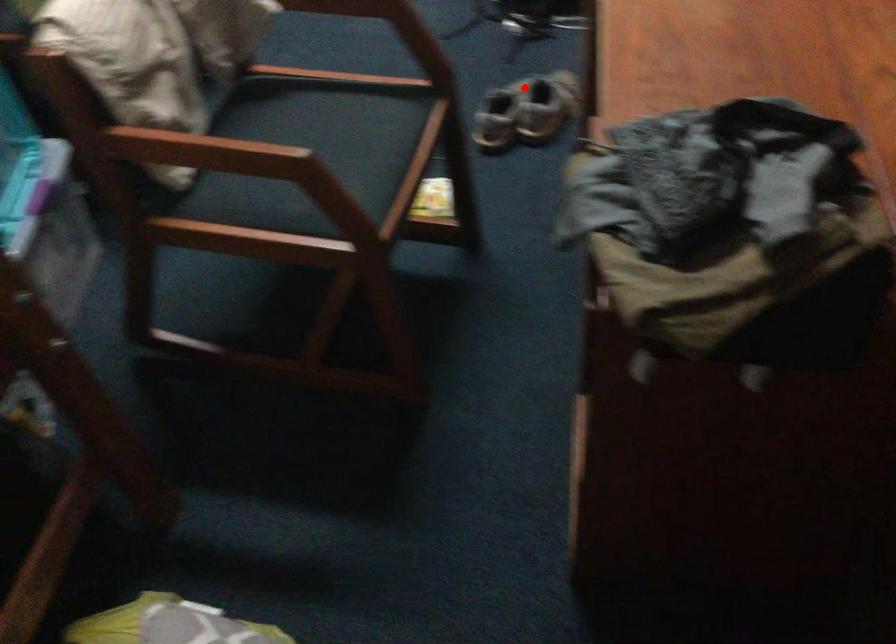
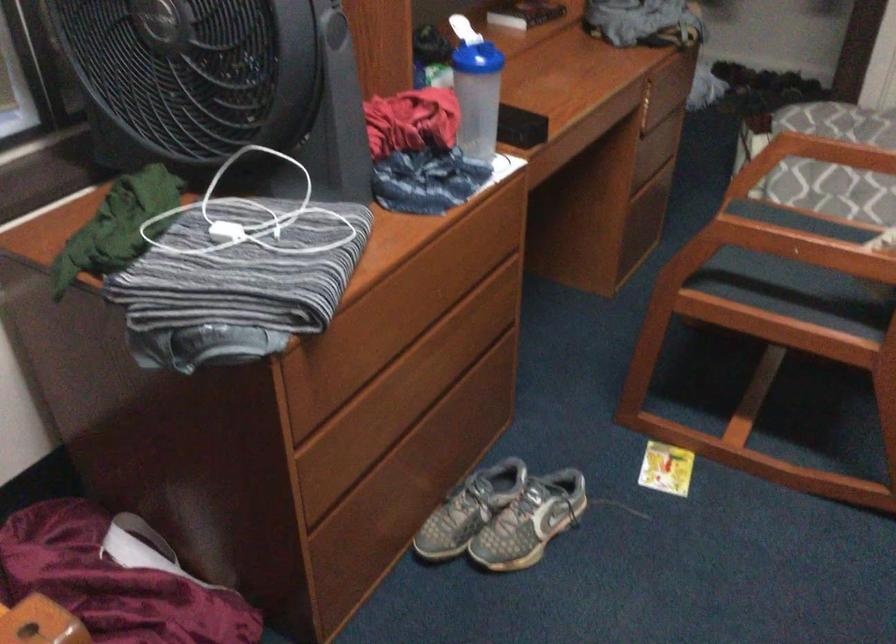
Find the pixel in the second image that matches the highlighted location in the first image.

(503, 516)